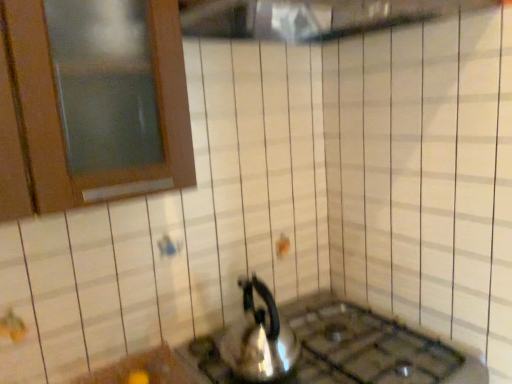
Question: From a real-world perspective, is satin silver gas stove at lower center below sleek metallic kettle at center?

Choices:
 (A) no
 (B) yes

Answer: (B)

Question: Is satin silver gas stove at lower center facing towards sleek metallic kettle at center?

Choices:
 (A) no
 (B) yes

Answer: (A)

Question: Is the depth of satin silver gas stove at lower center less than that of sleek metallic kettle at center?

Choices:
 (A) no
 (B) yes

Answer: (B)

Question: Is satin silver gas stove at lower center placed right next to sleek metallic kettle at center?

Choices:
 (A) yes
 (B) no

Answer: (B)

Question: Is satin silver gas stove at lower center wider than sleek metallic kettle at center?

Choices:
 (A) yes
 (B) no

Answer: (A)

Question: Can you confirm if satin silver gas stove at lower center is shorter than sleek metallic kettle at center?

Choices:
 (A) yes
 (B) no

Answer: (A)

Question: Considering the relative sizes of sleek metallic kettle at center and satin silver gas stove at lower center in the image provided, is sleek metallic kettle at center bigger than satin silver gas stove at lower center?

Choices:
 (A) no
 (B) yes

Answer: (A)

Question: Does sleek metallic kettle at center have a lesser width compared to satin silver gas stove at lower center?

Choices:
 (A) no
 (B) yes

Answer: (B)

Question: Is sleek metallic kettle at center facing towards satin silver gas stove at lower center?

Choices:
 (A) yes
 (B) no

Answer: (B)

Question: Is sleek metallic kettle at center positioned beyond the bounds of satin silver gas stove at lower center?

Choices:
 (A) yes
 (B) no

Answer: (A)

Question: From the image's perspective, is sleek metallic kettle at center below satin silver gas stove at lower center?

Choices:
 (A) no
 (B) yes

Answer: (A)

Question: From a real-world perspective, is sleek metallic kettle at center located beneath satin silver gas stove at lower center?

Choices:
 (A) no
 (B) yes

Answer: (A)

Question: From a real-world perspective, is satin silver gas stove at lower center above or below sleek metallic kettle at center?

Choices:
 (A) above
 (B) below

Answer: (B)